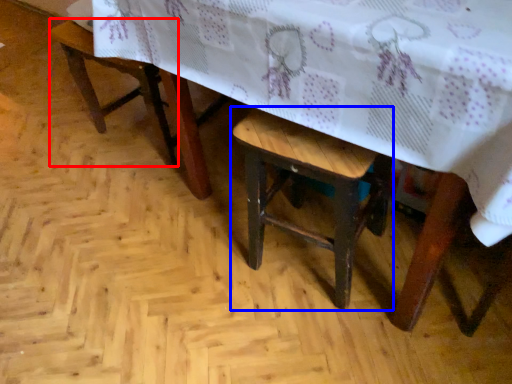
Question: Which object appears closest to the camera in this image, armchair (highlighted by a red box) or stool (highlighted by a blue box)?

Choices:
 (A) armchair
 (B) stool

Answer: (B)